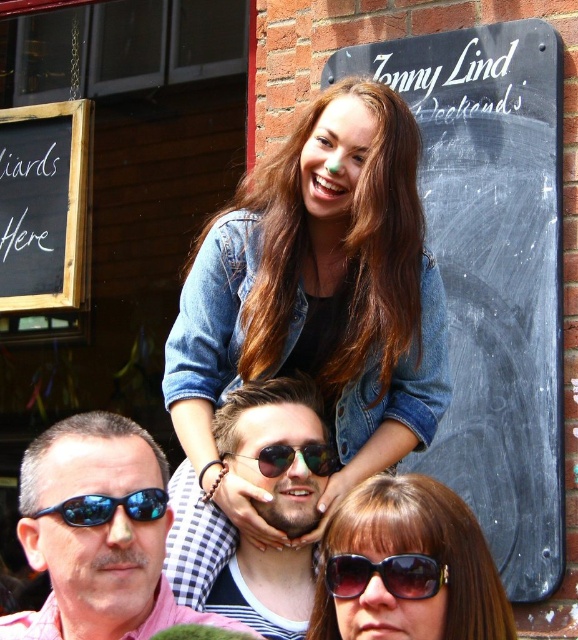
You are a photographer trying to capture a clear shot of both the denim jacket at center and the pink checkered shirt at center. Which object should you focus on first if you want to ensure it appears sharp in the photo?

The denim jacket at center is taller than the pink checkered shirt at center, so focusing on the denim jacket at center first would ensure it appears sharp since it occupies more space in the frame.

You are standing at the point with coordinates point (390, 579) and want to move to the point with coordinates point (273, 198). Which direction should you face to walk towards your destination?

You should face north to walk towards point (273, 198) from point (390, 579) since it is behind the starting point.

You are a photographer trying to capture a group photo of the denim jacket at center and the pink checkered shirt at center. The camera you are using has a maximum focus range of 20 feet. Will both subjects be in focus if you position yourself exactly between them?

The denim jacket at center and pink checkered shirt at center are 17.71 feet apart from each other. Since the camera can focus up to 20 feet, positioning yourself between them would mean each subject is about 8.85 feet away from the camera. This distance is within the camera maximum focus range of 20 feet, so both subjects will be in focus.